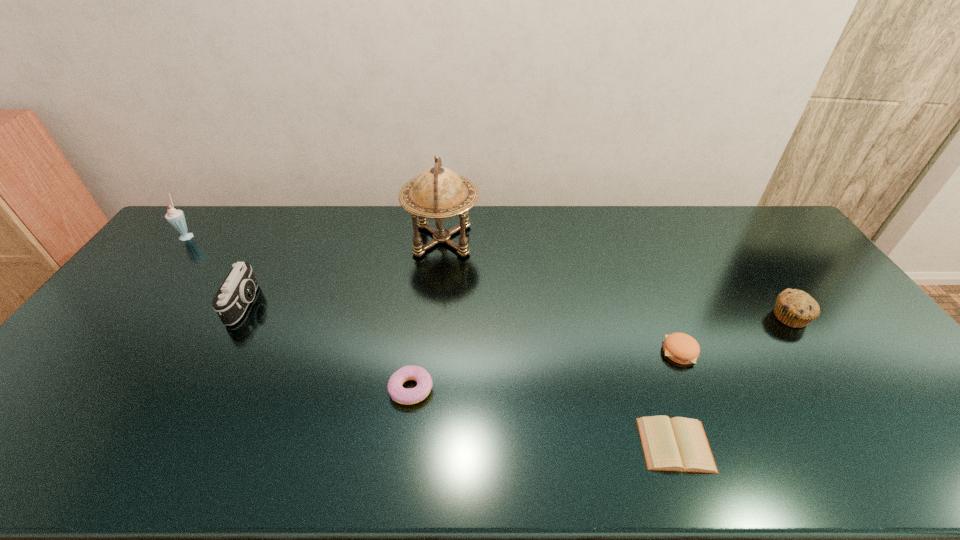
Find the location of a particular element. Image resolution: width=960 pixels, height=540 pixels. object that is positioned at the near edge is located at coordinates point(680,444).

Locate an element on the screen. The height and width of the screenshot is (540, 960). object that is at the left edge is located at coordinates [176, 218].

At what (x,y) coordinates should I click in order to perform the action: click on object at the right edge. Please return your answer as a coordinate pair (x, y). Looking at the image, I should click on (795, 308).

You are a GUI agent. You are given a task and a screenshot of the screen. Output one action in this format:
    pyautogui.click(x=<x>, y=<y>)
    Task: Click on the object at the far left corner
    The image size is (960, 540).
    Given the screenshot: What is the action you would take?
    pyautogui.click(x=176, y=218)

In the image, there is a desktop. Identify the location of vacant space at the far edge. (482, 241).

Find the location of a particular element. vacant area at the near edge is located at coordinates (303, 453).

This screenshot has width=960, height=540. I want to click on vacant point at the left edge, so click(x=79, y=367).

Locate an element on the screen. The height and width of the screenshot is (540, 960). blank space at the far right corner of the desktop is located at coordinates (757, 239).

You are a GUI agent. You are given a task and a screenshot of the screen. Output one action in this format:
    pyautogui.click(x=<x>, y=<y>)
    Task: Click on the free spot at the near right corner of the desktop
    This screenshot has width=960, height=540.
    Given the screenshot: What is the action you would take?
    pyautogui.click(x=959, y=460)

At what (x,y) coordinates should I click in order to perform the action: click on free space between the nearest object and the second nearest object. Please return your answer as a coordinate pair (x, y). The image size is (960, 540). Looking at the image, I should click on (543, 417).